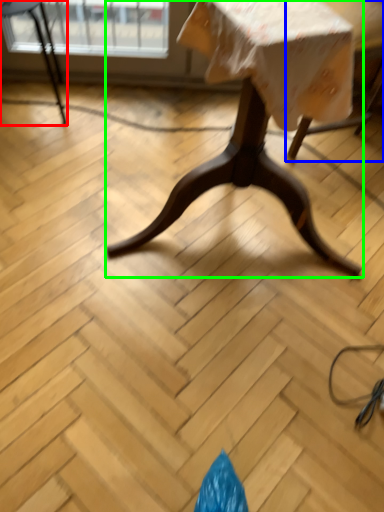
Question: Estimate the real-world distances between objects in this image. Which object is farther from chair (highlighted by a red box), swivel chair (highlighted by a blue box) or table (highlighted by a green box)?

Choices:
 (A) swivel chair
 (B) table

Answer: (B)